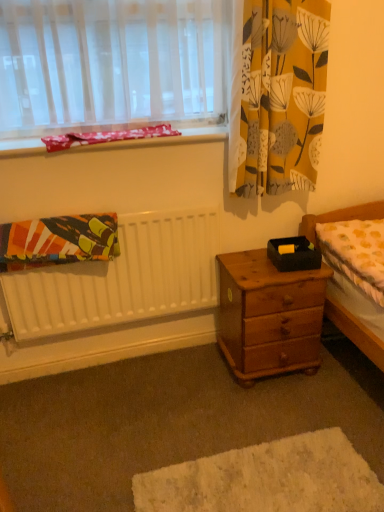
Question: Considering the relative sizes of wooden nightstand at center and textured cotton blanket at left in the image provided, is wooden nightstand at center bigger than textured cotton blanket at left?

Choices:
 (A) yes
 (B) no

Answer: (A)

Question: Can you confirm if wooden nightstand at center is taller than textured cotton blanket at left?

Choices:
 (A) no
 (B) yes

Answer: (B)

Question: Considering the relative sizes of wooden nightstand at center and textured cotton blanket at left in the image provided, is wooden nightstand at center smaller than textured cotton blanket at left?

Choices:
 (A) yes
 (B) no

Answer: (B)

Question: Does wooden nightstand at center have a greater width compared to textured cotton blanket at left?

Choices:
 (A) no
 (B) yes

Answer: (B)

Question: Considering the relative positions of wooden nightstand at center and textured cotton blanket at left in the image provided, is wooden nightstand at center behind textured cotton blanket at left?

Choices:
 (A) no
 (B) yes

Answer: (B)

Question: Considering the positions of yellow floral fabric at upper right and pink fabric at upper left in the image, is yellow floral fabric at upper right bigger or smaller than pink fabric at upper left?

Choices:
 (A) small
 (B) big

Answer: (B)

Question: In terms of width, does yellow floral fabric at upper right look wider or thinner when compared to pink fabric at upper left?

Choices:
 (A) thin
 (B) wide

Answer: (A)

Question: Is point (258, 173) positioned closer to the camera than point (157, 140)?

Choices:
 (A) closer
 (B) farther

Answer: (B)

Question: Choose the correct answer: Is yellow floral fabric at upper right inside pink fabric at upper left or outside it?

Choices:
 (A) inside
 (B) outside

Answer: (B)

Question: Is yellow dotted fabric at right to the left or to the right of wooden drawer at lower right in the image?

Choices:
 (A) left
 (B) right

Answer: (B)

Question: In terms of width, does yellow dotted fabric at right look wider or thinner when compared to wooden drawer at lower right?

Choices:
 (A) thin
 (B) wide

Answer: (A)

Question: From a real-world perspective, is yellow dotted fabric at right physically located above or below wooden drawer at lower right?

Choices:
 (A) below
 (B) above

Answer: (B)

Question: Is yellow dotted fabric at right bigger or smaller than wooden drawer at lower right?

Choices:
 (A) big
 (B) small

Answer: (B)

Question: From the image's perspective, is wooden nightstand at center located above or below pink fabric at upper left?

Choices:
 (A) above
 (B) below

Answer: (B)

Question: In terms of height, does wooden nightstand at center look taller or shorter compared to pink fabric at upper left?

Choices:
 (A) tall
 (B) short

Answer: (A)